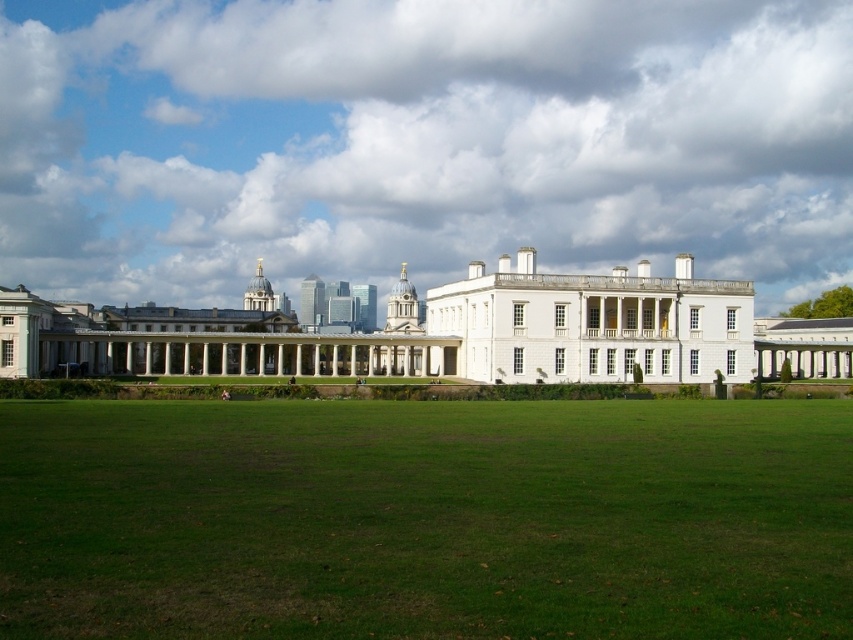
Question: Is green grass at center wider than white glossy mansion at center?

Choices:
 (A) yes
 (B) no

Answer: (B)

Question: Which point appears closest to the camera in this image?

Choices:
 (A) (751, 342)
 (B) (25, 468)

Answer: (B)

Question: Among these points, which one is nearest to the camera?

Choices:
 (A) (532, 589)
 (B) (0, 308)

Answer: (A)

Question: Does green grass at center appear over white glossy mansion at center?

Choices:
 (A) no
 (B) yes

Answer: (A)

Question: Is green grass at center positioned at the back of white glossy mansion at center?

Choices:
 (A) yes
 (B) no

Answer: (B)